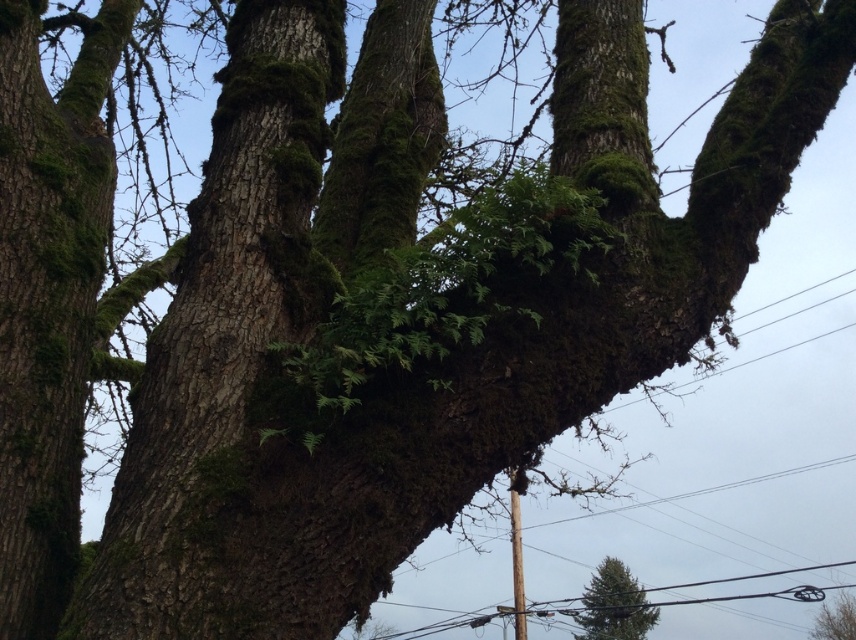
Looking at this image, which is more to the left, green mossy tree trunk at left or brown wooden pole at lower center?

Positioned to the left is green mossy tree trunk at left.

Which is behind, point (73, 216) or point (574, 602)?

The point (574, 602) is more distant.

You are a GUI agent. You are given a task and a screenshot of the screen. Output one action in this format:
    pyautogui.click(x=<x>, y=<y>)
    Task: Click on the green mossy tree trunk at left
    The image size is (856, 640).
    Given the screenshot: What is the action you would take?
    pyautogui.click(x=48, y=298)

Does brown wooden pole at lower center have a lesser width compared to green mossy tree at center?

No, brown wooden pole at lower center is not thinner than green mossy tree at center.

Locate an element on the screen. brown wooden pole at lower center is located at coordinates (753, 589).

Between point (696, 586) and point (598, 566), which one is positioned in front?

Positioned in front is point (598, 566).

Looking at this image, between brown wooden pole at lower center and green textured pine tree at lower right, which one appears on the left side from the viewer's perspective?

green textured pine tree at lower right is more to the left.

Who is more distant from viewer, (531, 604) or (626, 566)?

The point (531, 604) is more distant.

At what (x,y) coordinates should I click in order to perform the action: click on brown wooden pole at lower center. Please return your answer as a coordinate pair (x, y). The width and height of the screenshot is (856, 640). Looking at the image, I should click on (753, 589).